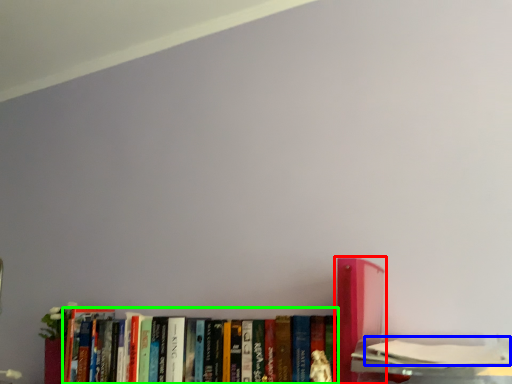
Question: Which object is positioned closest to book (highlighted by a red box)? Select from book (highlighted by a blue box) and book (highlighted by a green box).

Choices:
 (A) book
 (B) book

Answer: (A)